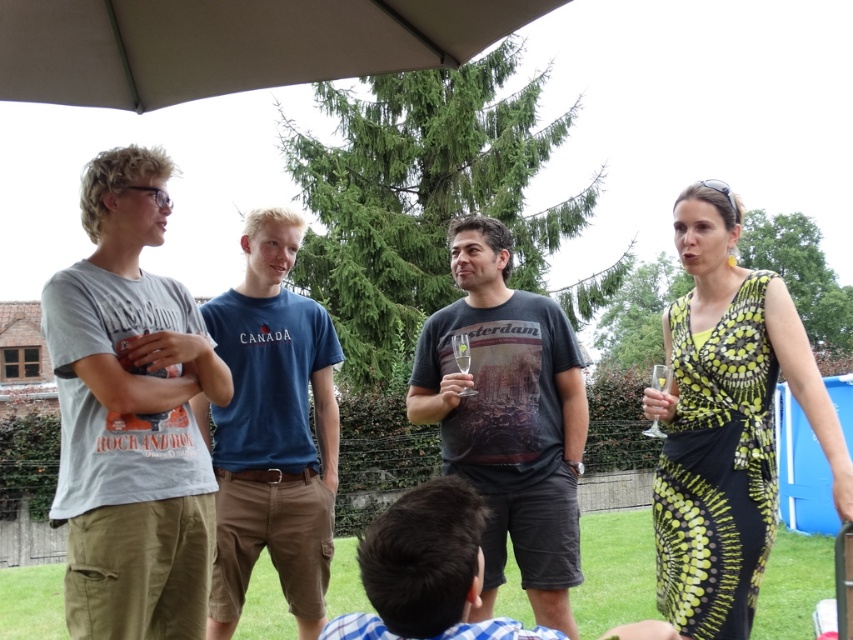
You are planning to seat two guests at a narrow table that can only accommodate one person comfortably. The guests are wearing the printed silk dress at right and the blue striped shirt at lower center. Which guest should you seat first to ensure comfort?

The blue striped shirt at lower center should be seated first because the printed silk dress at right is wider, making it harder to fit comfortably at the narrow table.